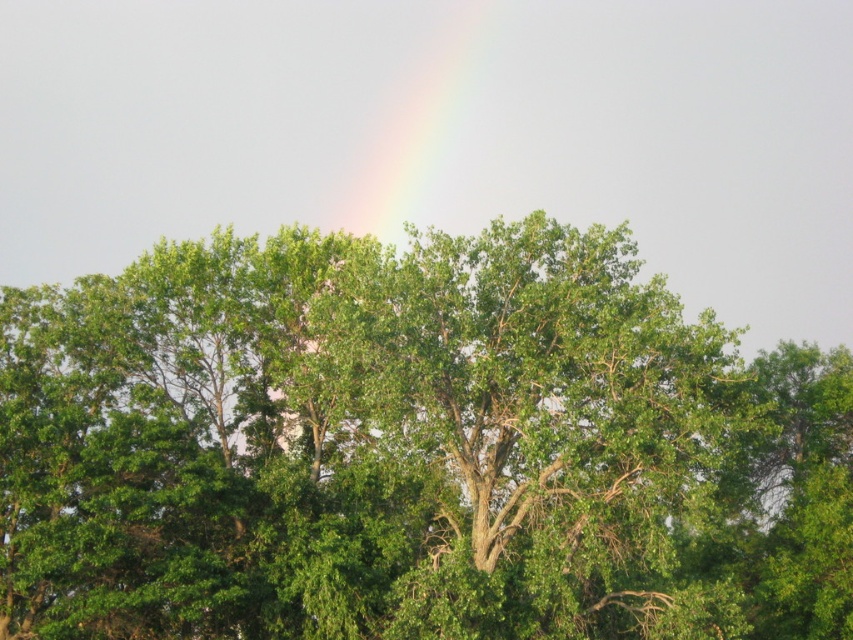
Question: Is green leafy tree at center thinner than rainbow at upper center?

Choices:
 (A) yes
 (B) no

Answer: (B)

Question: Does green leafy tree at center lie behind rainbow at upper center?

Choices:
 (A) no
 (B) yes

Answer: (A)

Question: Can you confirm if green leafy tree at center is positioned below rainbow at upper center?

Choices:
 (A) no
 (B) yes

Answer: (B)

Question: Which point is farther from the camera taking this photo?

Choices:
 (A) (196, 369)
 (B) (418, 52)

Answer: (B)